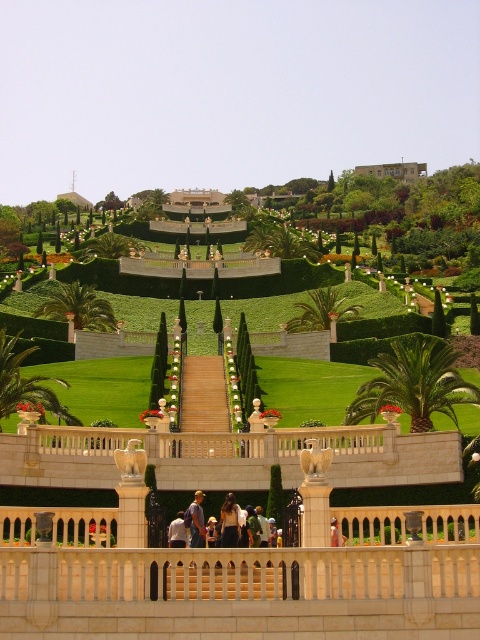
Question: Which point is closer to the camera?

Choices:
 (A) (210, 374)
 (B) (403, 176)

Answer: (A)

Question: Is light beige stone stairs at center wider than beige stone building at upper center?

Choices:
 (A) no
 (B) yes

Answer: (A)

Question: Can you confirm if light beige stone stairs at center is positioned above beige stone building at upper center?

Choices:
 (A) yes
 (B) no

Answer: (B)

Question: Which point is farther to the camera?

Choices:
 (A) (228, 595)
 (B) (220, 380)
 (C) (379, 172)

Answer: (C)

Question: Which object is farther from the camera taking this photo?

Choices:
 (A) wooden stairs at center
 (B) beige stone building at upper center
 (C) light beige stone stairs at center

Answer: (B)

Question: Can you confirm if wooden stairs at center is smaller than beige stone building at upper center?

Choices:
 (A) yes
 (B) no

Answer: (A)